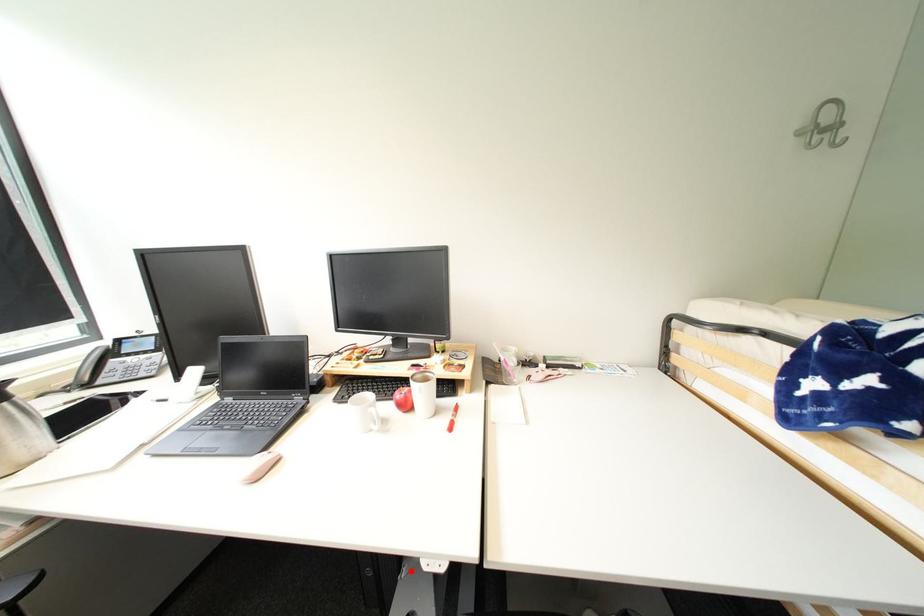
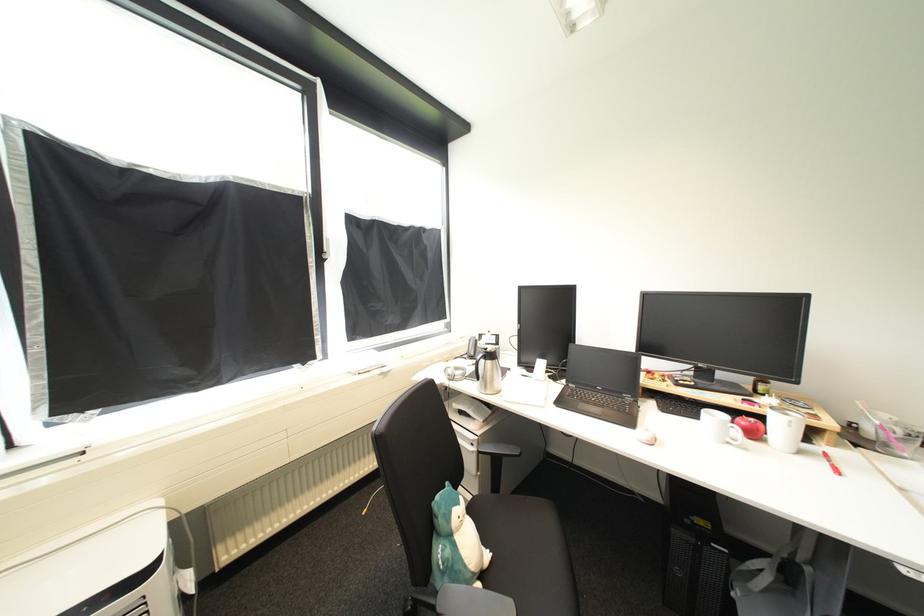
Question: A red point is marked in image1. In image2, is the corresponding 3D point closer to the camera or farther? Reply with the corresponding letter.

Choices:
 (A) The corresponding 3D point is closer.
 (B) The corresponding 3D point is farther.

Answer: (B)